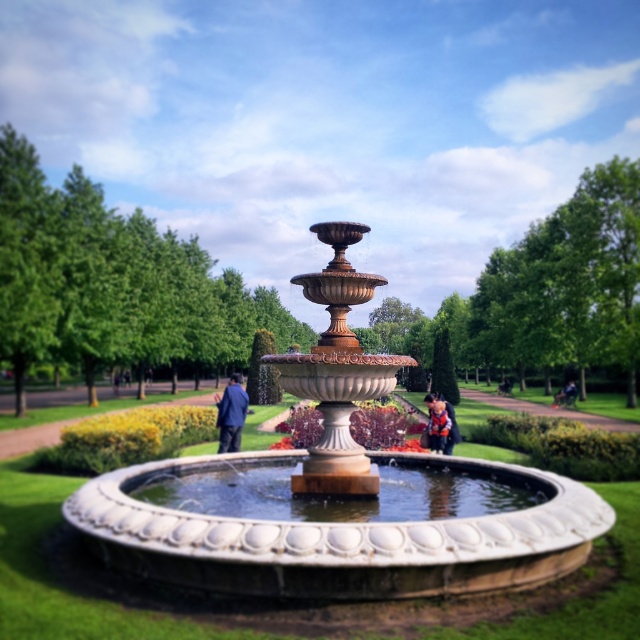
Question: Which object appears farthest from the camera in this image?

Choices:
 (A) orange life vest at center
 (B) white stone fountain at center

Answer: (A)

Question: Does white stone fountain at center have a smaller size compared to blue fabric jacket at center?

Choices:
 (A) no
 (B) yes

Answer: (B)

Question: Among these objects, which one is farthest from the camera?

Choices:
 (A) orange life vest at center
 (B) white stone fountain at center
 (C) blue fabric jacket at center

Answer: (C)

Question: Can you confirm if white stone fountain at center is positioned to the right of orange life vest at center?

Choices:
 (A) no
 (B) yes

Answer: (A)

Question: Is white stone fountain at center positioned before blue fabric jacket at center?

Choices:
 (A) no
 (B) yes

Answer: (B)

Question: Which point appears closest to the camera in this image?

Choices:
 (A) (362, 577)
 (B) (220, 404)
 (C) (426, 401)

Answer: (A)